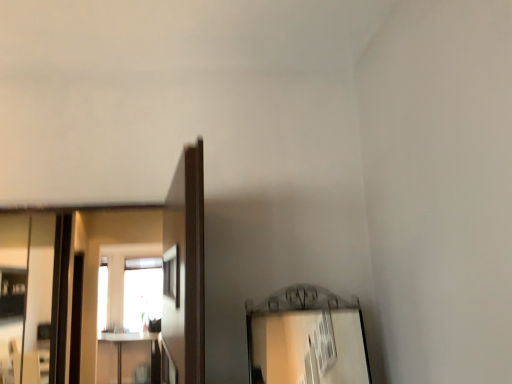
Question: Is silver metallic mirror at left, which is the first mirror in front-to-back order, facing towards clear glass mirror at left, which is the 2th mirror from front to back?

Choices:
 (A) no
 (B) yes

Answer: (A)

Question: Is silver metallic mirror at left, which is the first mirror in front-to-back order, closer to the viewer compared to clear glass mirror at left, the 1th mirror positioned from the back?

Choices:
 (A) no
 (B) yes

Answer: (B)

Question: Is silver metallic mirror at left, which is the first mirror in front-to-back order, taller than clear glass mirror at left, the 1th mirror positioned from the back?

Choices:
 (A) yes
 (B) no

Answer: (B)

Question: From a real-world perspective, is silver metallic mirror at left, which is counted as the first mirror, starting from the right, below clear glass mirror at left, which appears as the first mirror when viewed from the left?

Choices:
 (A) yes
 (B) no

Answer: (B)

Question: Is silver metallic mirror at left, the second mirror from the back, positioned beyond the bounds of clear glass mirror at left, which appears as the first mirror when viewed from the left?

Choices:
 (A) yes
 (B) no

Answer: (A)

Question: From the image's perspective, does silver metallic mirror at left, which is the first mirror in front-to-back order, appear lower than clear glass mirror at left, acting as the second mirror starting from the right?

Choices:
 (A) no
 (B) yes

Answer: (A)

Question: Does clear glass mirror at left, which is the 2th mirror from front to back, come behind silver metallic mirror at left, which is counted as the 2th mirror, starting from the left?

Choices:
 (A) no
 (B) yes

Answer: (B)

Question: Does clear glass mirror at left, acting as the second mirror starting from the right, appear on the left side of silver metallic mirror at left, which is the first mirror in front-to-back order?

Choices:
 (A) no
 (B) yes

Answer: (B)

Question: Is silver metallic mirror at left, which is counted as the 2th mirror, starting from the left, surrounded by clear glass mirror at left, the 1th mirror positioned from the back?

Choices:
 (A) yes
 (B) no

Answer: (B)

Question: Does clear glass mirror at left, acting as the second mirror starting from the right, have a larger size compared to silver metallic mirror at left, which is counted as the first mirror, starting from the right?

Choices:
 (A) no
 (B) yes

Answer: (B)

Question: Are clear glass mirror at left, which appears as the first mirror when viewed from the left, and silver metallic mirror at left, the second mirror from the back, located far from each other?

Choices:
 (A) no
 (B) yes

Answer: (A)

Question: From a real-world perspective, does clear glass mirror at left, which appears as the first mirror when viewed from the left, stand above silver metallic mirror at left, which is counted as the first mirror, starting from the right?

Choices:
 (A) yes
 (B) no

Answer: (B)

Question: Is silver metallic mirror at left, which is the first mirror in front-to-back order, wider or thinner than clear glass mirror at left, which appears as the first mirror when viewed from the left?

Choices:
 (A) wide
 (B) thin

Answer: (B)